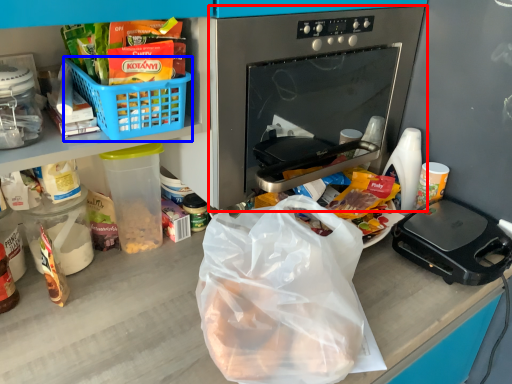
Question: Which of the following is the closest to the observer, oven (highlighted by a red box) or basket (highlighted by a blue box)?

Choices:
 (A) oven
 (B) basket

Answer: (B)